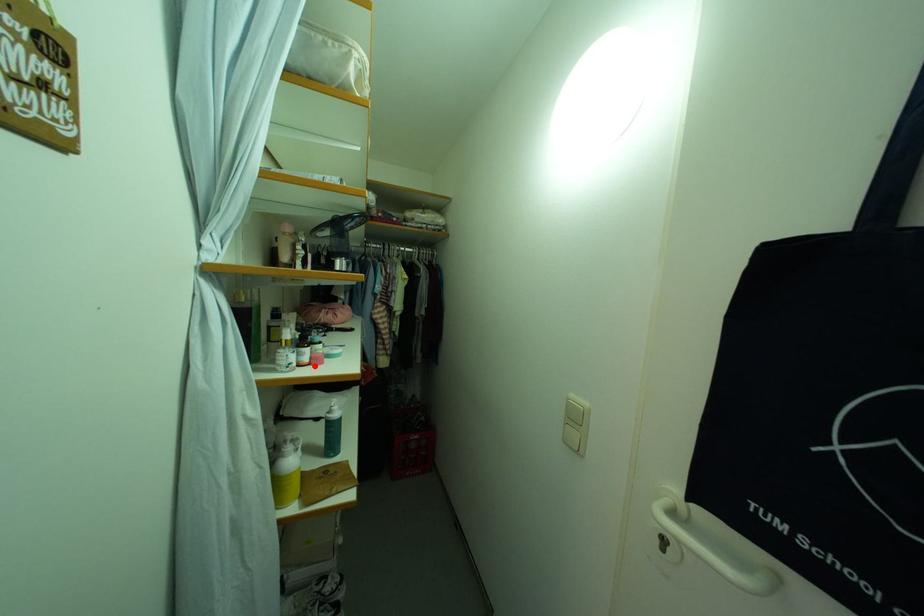
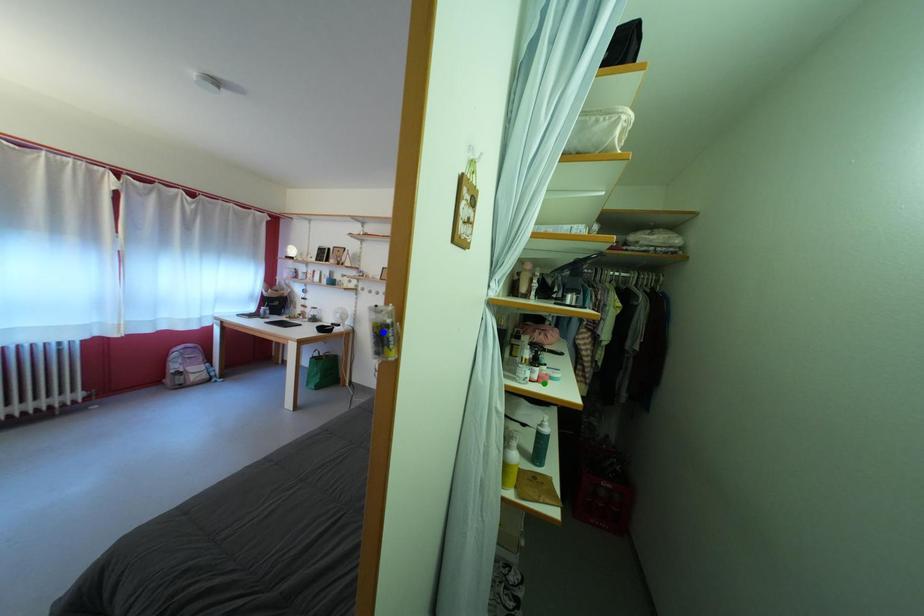
Question: I am providing you with two images of the same scene from different viewpoints. A red point is marked on the first image. You are given multiple points on the second image. Which spot in image 2 lines up with the point in image 1?

Choices:
 (A) yellow point
 (B) green point
 (C) blue point

Answer: (B)